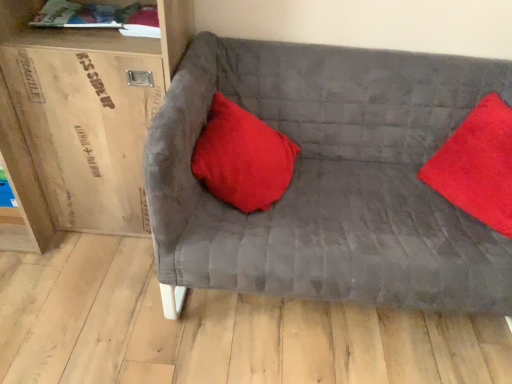
Describe the element at coordinates (329, 178) in the screenshot. I see `velvet gray couch at center` at that location.

Find the location of a particular element. The height and width of the screenshot is (384, 512). satin red pillow at center, the second pillow positioned from the right is located at coordinates (242, 157).

Identify the location of wooden cardboard box at left. The height and width of the screenshot is (384, 512). (87, 131).

In terms of size, does hardcover book at upper left appear bigger or smaller than satin red pillow at center, the second pillow positioned from the right?

Considering their sizes, hardcover book at upper left takes up less space than satin red pillow at center, the second pillow positioned from the right.

Is point (148, 5) behind point (227, 130)?

No, (148, 5) is in front of (227, 130).

Considering the positions of objects hardcover book at upper left and satin red pillow at center, positioned as the first pillow in left-to-right order, in the image provided, who is in front, hardcover book at upper left or satin red pillow at center, positioned as the first pillow in left-to-right order,?

satin red pillow at center, positioned as the first pillow in left-to-right order, is in front.

Would you say satin red pillow at center, the second pillow positioned from the right, is inside or outside hardcover book at upper left?

The correct answer is: outside.

Measure the distance between satin red pillow at center, the second pillow positioned from the right, and hardcover book at upper left.

satin red pillow at center, the second pillow positioned from the right, and hardcover book at upper left are 18.51 inches apart from each other.

Considering the sizes of objects satin red pillow at center, the second pillow positioned from the right, and hardcover book at upper left in the image provided, who is bigger, satin red pillow at center, the second pillow positioned from the right, or hardcover book at upper left?

With larger size is satin red pillow at center, the second pillow positioned from the right.

Is satin red pillow at center, the second pillow positioned from the right, positioned far away from hardcover book at upper left?

Actually, satin red pillow at center, the second pillow positioned from the right, and hardcover book at upper left are a little close together.

In terms of height, does velvet gray couch at center look taller or shorter compared to satin red pillow at center, positioned as the first pillow in left-to-right order?

In the image, velvet gray couch at center appears to be taller than satin red pillow at center, positioned as the first pillow in left-to-right order.

Considering the sizes of objects velvet gray couch at center and satin red pillow at center, the second pillow positioned from the right, in the image provided, who is smaller, velvet gray couch at center or satin red pillow at center, the second pillow positioned from the right,?

satin red pillow at center, the second pillow positioned from the right, is smaller.

Does point (419, 200) come farther from viewer compared to point (240, 178)?

Yes, point (419, 200) is behind point (240, 178).

Is velvet gray couch at center oriented away from satin red pillow at center, positioned as the first pillow in left-to-right order?

Yes, velvet gray couch at center is facing away from satin red pillow at center, positioned as the first pillow in left-to-right order.

Considering the relative positions of wooden cardboard box at left and velvet gray couch at center in the image provided, is wooden cardboard box at left to the right of velvet gray couch at center from the viewer's perspective?

In fact, wooden cardboard box at left is to the left of velvet gray couch at center.

From a real-world perspective, between wooden cardboard box at left and velvet gray couch at center, who is vertically lower?

In real-world perspective, velvet gray couch at center is lower.

Which object is wider, wooden cardboard box at left or velvet gray couch at center?

With larger width is velvet gray couch at center.

Is wooden cardboard box at left closer to the viewer compared to velvet gray couch at center?

No.

From a real-world perspective, is wooden cardboard box at left positioned above or below velvet red pillow at right, acting as the 1th pillow starting from the right?

From a real-world perspective, wooden cardboard box at left is physically below velvet red pillow at right, acting as the 1th pillow starting from the right.

Based on the photo, can you confirm if wooden cardboard box at left is smaller than velvet red pillow at right, acting as the 1th pillow starting from the right?

No.

Could you tell me if wooden cardboard box at left is facing velvet red pillow at right, acting as the 1th pillow starting from the right?

No.

Locate an element on the screen. cardboard box on the left side of velvet red pillow at right, the 2th pillow from the left is located at coordinates (87, 131).

Is hardcover book at upper left inside or outside of velvet gray couch at center?

hardcover book at upper left exists outside the volume of velvet gray couch at center.

Is hardcover book at upper left far away from velvet gray couch at center?

No, there isn't a large distance between hardcover book at upper left and velvet gray couch at center.

Which of these two, hardcover book at upper left or velvet gray couch at center, is wider?

velvet gray couch at center is wider.

Is velvet red pillow at right, the 2th pillow from the left, in contact with velvet gray couch at center?

No, velvet red pillow at right, the 2th pillow from the left, is not touching velvet gray couch at center.

I want to click on studio couch that appears on the left of velvet red pillow at right, the 2th pillow from the left, so click(x=329, y=178).

Can velvet gray couch at center be found inside velvet red pillow at right, the 2th pillow from the left?

No.

Looking at their sizes, would you say velvet red pillow at right, acting as the 1th pillow starting from the right, is wider or thinner than velvet gray couch at center?

In the image, velvet red pillow at right, acting as the 1th pillow starting from the right, appears to be more narrow than velvet gray couch at center.

Locate an element on the screen. the 1st pillow counting from the right side of the hardcover book at upper left is located at coordinates (242, 157).

At what (x,y) coordinates should I click in order to perform the action: click on book above the satin red pillow at center, positioned as the first pillow in left-to-right order (from a real-world perspective). Please return your answer as a coordinate pair (x, y). Looking at the image, I should click on (100, 17).

From the image, which object appears to be nearer to hardcover book at upper left, wooden cardboard box at left or velvet gray couch at center?

wooden cardboard box at left is closer to hardcover book at upper left.

Looking at the image, which one is located closer to satin red pillow at center, the second pillow positioned from the right, wooden cardboard box at left or velvet gray couch at center?

The object closer to satin red pillow at center, the second pillow positioned from the right, is velvet gray couch at center.

Based on their spatial positions, is hardcover book at upper left or wooden cardboard box at left closer to velvet gray couch at center?

wooden cardboard box at left is positioned closer to the anchor velvet gray couch at center.

When comparing their distances from velvet red pillow at right, acting as the 1th pillow starting from the right, does satin red pillow at center, positioned as the first pillow in left-to-right order, or velvet gray couch at center seem further?

satin red pillow at center, positioned as the first pillow in left-to-right order.

Which object lies nearer to the anchor point wooden cardboard box at left, velvet gray couch at center or hardcover book at upper left?

Based on the image, hardcover book at upper left appears to be nearer to wooden cardboard box at left.

When comparing their distances from hardcover book at upper left, does velvet gray couch at center or satin red pillow at center, positioned as the first pillow in left-to-right order, seem closer?

satin red pillow at center, positioned as the first pillow in left-to-right order.

Estimate the real-world distances between objects in this image. Which object is closer to wooden cardboard box at left, satin red pillow at center, positioned as the first pillow in left-to-right order, or velvet gray couch at center?

satin red pillow at center, positioned as the first pillow in left-to-right order.

Which object lies further to the anchor point velvet red pillow at right, the 2th pillow from the left, hardcover book at upper left or wooden cardboard box at left?

Among the two, hardcover book at upper left is located further to velvet red pillow at right, the 2th pillow from the left.

This screenshot has height=384, width=512. I want to click on studio couch located between satin red pillow at center, positioned as the first pillow in left-to-right order, and velvet red pillow at right, the 2th pillow from the left, in the left-right direction, so click(x=329, y=178).

The width and height of the screenshot is (512, 384). I want to click on pillow between wooden cardboard box at left and velvet gray couch at center, so click(x=242, y=157).

Locate an element on the screen. The height and width of the screenshot is (384, 512). pillow located between hardcover book at upper left and velvet red pillow at right, acting as the 1th pillow starting from the right, in the left-right direction is located at coordinates (242, 157).

Locate an element on the screen. The width and height of the screenshot is (512, 384). cardboard box between hardcover book at upper left and satin red pillow at center, the second pillow positioned from the right, from left to right is located at coordinates pos(87,131).